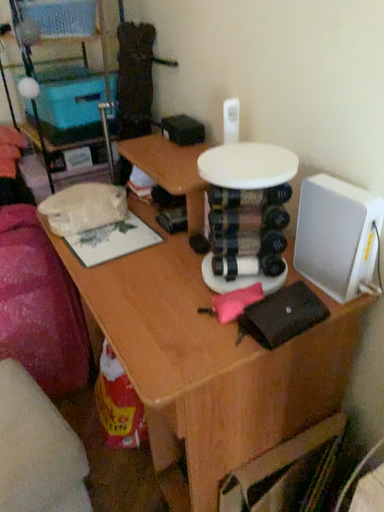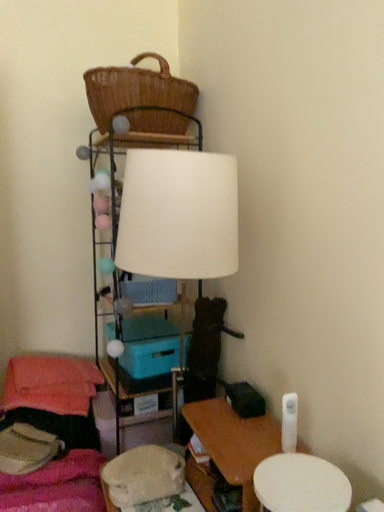
Question: How did the camera likely rotate when shooting the video?

Choices:
 (A) rotated downward
 (B) rotated upward

Answer: (B)